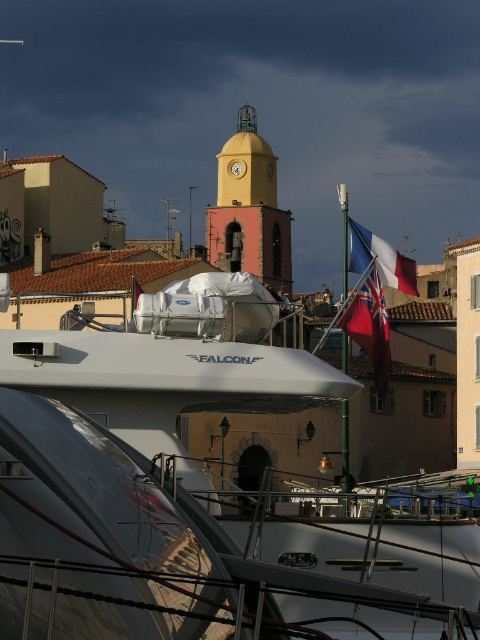
Question: Among these points, which one is farthest from the camera?

Choices:
 (A) (99, 561)
 (B) (384, 346)

Answer: (B)

Question: In this image, where is red fabric flag at center located relative to matte fabric flag at upper center?

Choices:
 (A) below
 (B) above

Answer: (A)

Question: Which of the following is the farthest from the observer?

Choices:
 (A) red fabric flag at center
 (B) white glossy boat at center
 (C) matte fabric flag at upper center

Answer: (A)

Question: Which is nearer to the matte fabric flag at upper center?

Choices:
 (A) white glossy boat at center
 (B) red fabric flag at center

Answer: (B)

Question: Is white glossy boat at center to the right of matte fabric flag at upper center from the viewer's perspective?

Choices:
 (A) yes
 (B) no

Answer: (B)

Question: Can you confirm if white glossy boat at center is positioned below matte fabric flag at upper center?

Choices:
 (A) yes
 (B) no

Answer: (A)